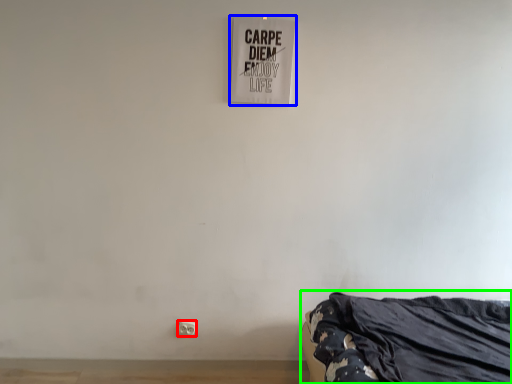
Question: Based on their relative distances, which object is farther from electric outlet (highlighted by a red box)? Choose from signage (highlighted by a blue box) and furniture (highlighted by a green box).

Choices:
 (A) signage
 (B) furniture

Answer: (A)